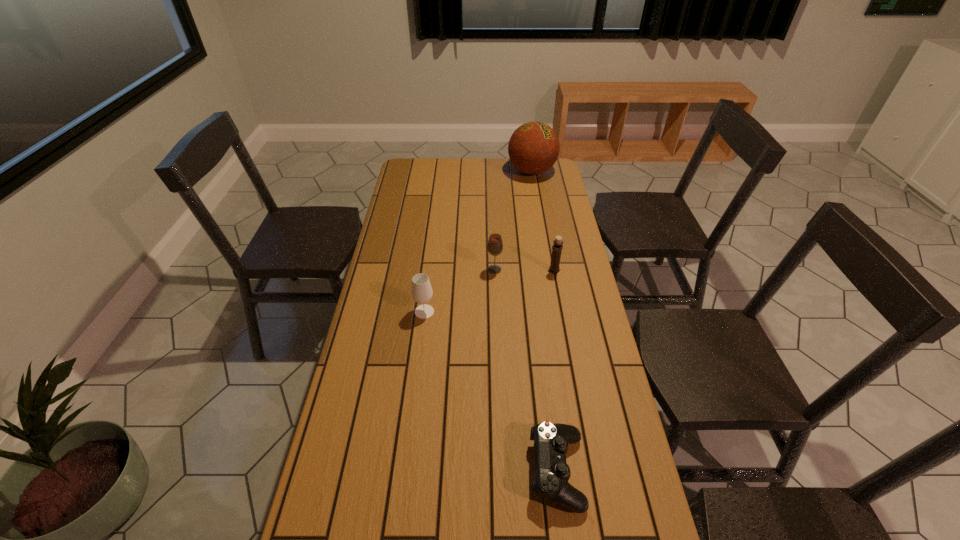
The height and width of the screenshot is (540, 960). I want to click on free space located on the front of the candle holder, so click(x=561, y=308).

Find the location of a particular element. This screenshot has height=540, width=960. free location located on the right of the farther glass is located at coordinates (546, 270).

Where is `free location located on the front of the left glass`? free location located on the front of the left glass is located at coordinates (413, 405).

This screenshot has height=540, width=960. I want to click on vacant space located 0.100m on the right of the shortest object, so click(x=627, y=471).

Identify the location of object that is positioned at the far edge. Image resolution: width=960 pixels, height=540 pixels. (533, 148).

This screenshot has height=540, width=960. I want to click on object located in the left edge section of the desktop, so click(421, 292).

You are a GUI agent. You are given a task and a screenshot of the screen. Output one action in this format:
    pyautogui.click(x=<x>, y=<y>)
    Task: Click on the basketball located in the right edge section of the desktop
    The width and height of the screenshot is (960, 540).
    Given the screenshot: What is the action you would take?
    pyautogui.click(x=533, y=148)

Where is `candle holder that is at the right edge`? candle holder that is at the right edge is located at coordinates (557, 248).

At what (x,y) coordinates should I click in order to perform the action: click on control that is at the right edge. Please return your answer as a coordinate pair (x, y). Image resolution: width=960 pixels, height=540 pixels. Looking at the image, I should click on (552, 473).

Where is `object that is at the far right corner`? The width and height of the screenshot is (960, 540). object that is at the far right corner is located at coordinates (533, 148).